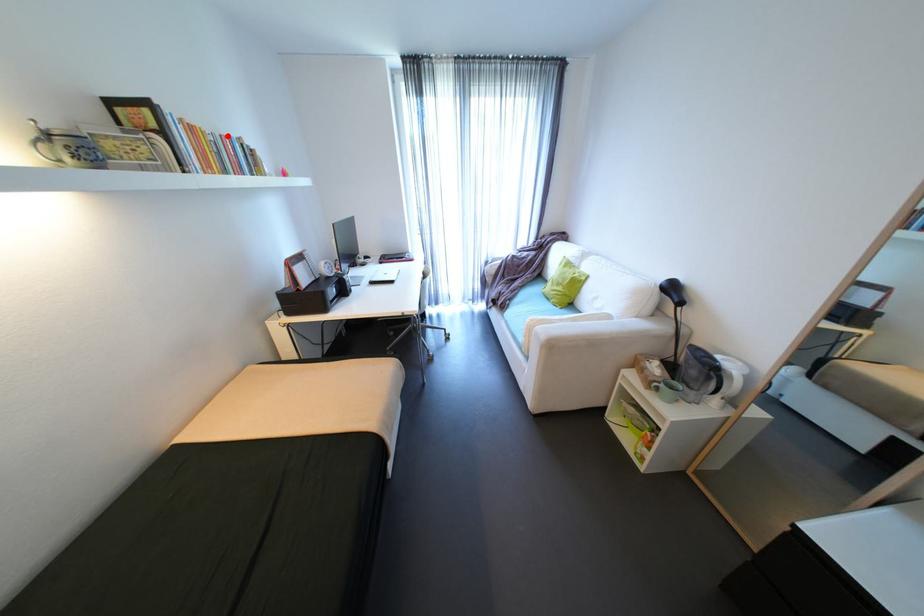
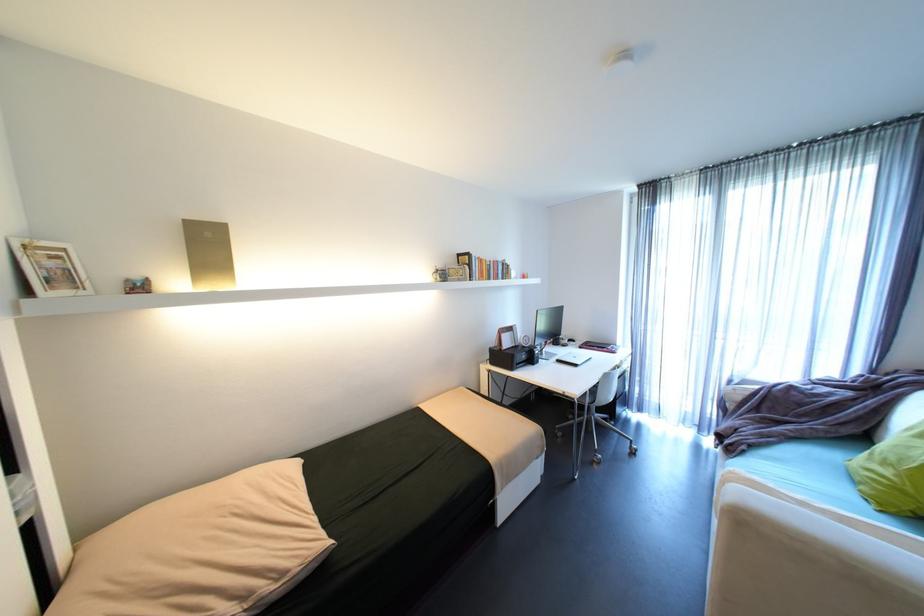
Locate, in the second image, the point that corresponds to the highlighted location in the first image.

(500, 262)